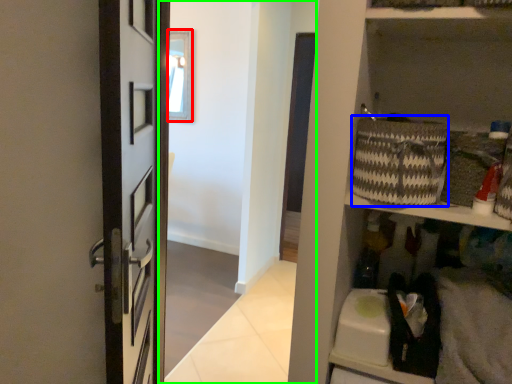
Question: Based on their relative distances, which object is farther from window (highlighted by a red box)? Choose from basket (highlighted by a blue box) and corridor (highlighted by a green box).

Choices:
 (A) basket
 (B) corridor

Answer: (A)